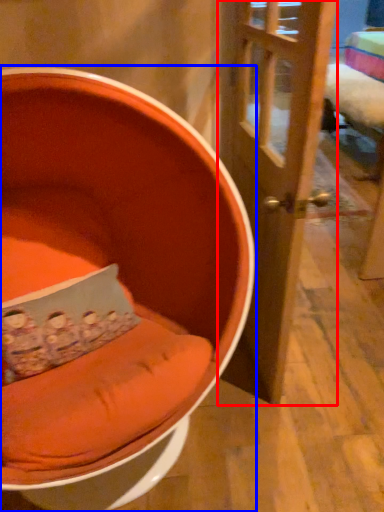
Question: Which point is closer to the camera, door (highlighted by a red box) or chair (highlighted by a blue box)?

Choices:
 (A) door
 (B) chair

Answer: (B)